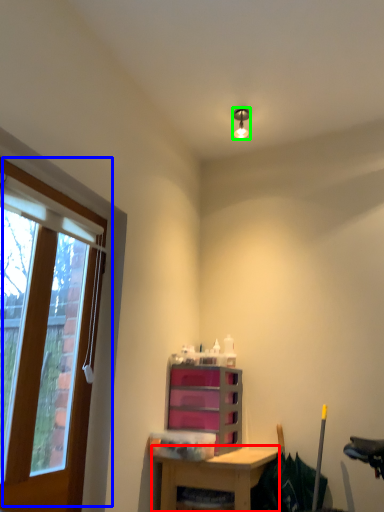
Question: Considering the real-world distances, which object is farthest from desk (highlighted by a red box)? window (highlighted by a blue box) or light fixture (highlighted by a green box)?

Choices:
 (A) window
 (B) light fixture

Answer: (B)